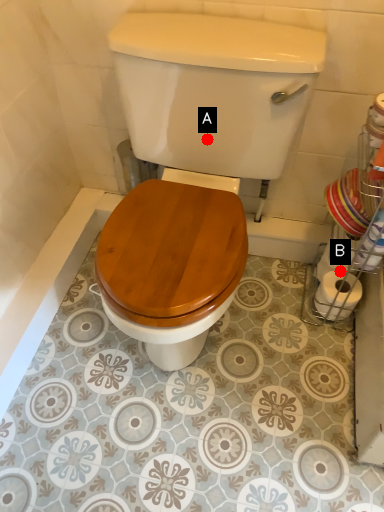
Question: Two points are circled on the image, labeled by A and B beside each circle. Which point is closer to the camera?

Choices:
 (A) A is closer
 (B) B is closer

Answer: (A)